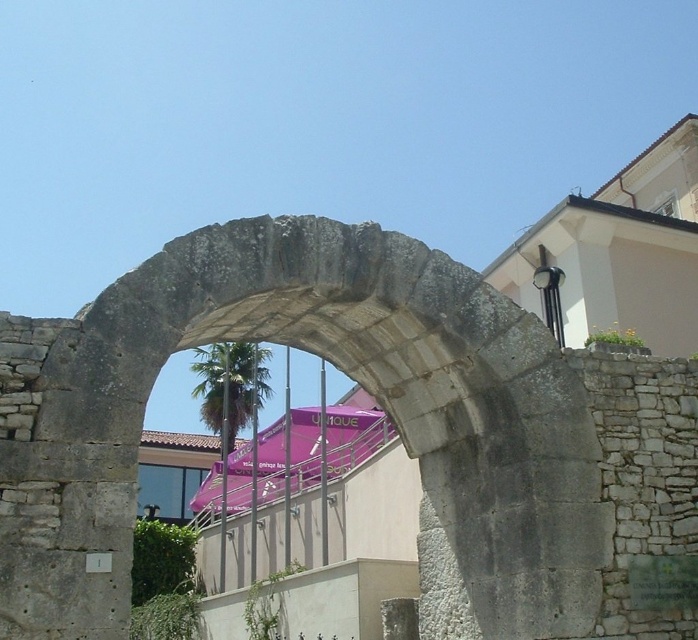
Is gray stone archway at center above green leafy palm tree at center?

Indeed, gray stone archway at center is positioned over green leafy palm tree at center.

Is point (131, 330) closer to camera compared to point (244, 397)?

That is True.

You are a GUI agent. You are given a task and a screenshot of the screen. Output one action in this format:
    pyautogui.click(x=<x>, y=<y>)
    Task: Click on the gray stone archway at center
    The image size is (698, 640).
    Given the screenshot: What is the action you would take?
    pyautogui.click(x=349, y=376)